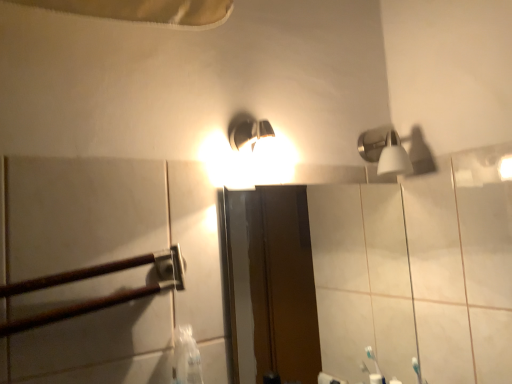
Question: From the image's perspective, would you say brown wooden rail at left is shown under matte glass mirror at center?

Choices:
 (A) yes
 (B) no

Answer: (B)

Question: Is brown wooden rail at left to the left of matte glass mirror at center from the viewer's perspective?

Choices:
 (A) no
 (B) yes

Answer: (B)

Question: Does brown wooden rail at left have a lesser width compared to matte glass mirror at center?

Choices:
 (A) no
 (B) yes

Answer: (A)

Question: Is there a large distance between brown wooden rail at left and matte glass mirror at center?

Choices:
 (A) yes
 (B) no

Answer: (B)

Question: From the image's perspective, would you say brown wooden rail at left is positioned over matte glass mirror at center?

Choices:
 (A) no
 (B) yes

Answer: (B)

Question: Does brown wooden rail at left have a larger size compared to matte glass mirror at center?

Choices:
 (A) yes
 (B) no

Answer: (B)

Question: Is matte glass mirror at center in contact with brown wooden rail at left?

Choices:
 (A) yes
 (B) no

Answer: (B)

Question: Considering the relative sizes of matte glass mirror at center and brown wooden rail at left in the image provided, is matte glass mirror at center taller than brown wooden rail at left?

Choices:
 (A) yes
 (B) no

Answer: (A)

Question: From the image's perspective, is matte glass mirror at center located beneath brown wooden rail at left?

Choices:
 (A) no
 (B) yes

Answer: (B)

Question: Does matte glass mirror at center have a greater width compared to brown wooden rail at left?

Choices:
 (A) yes
 (B) no

Answer: (B)

Question: Is matte glass mirror at center behind brown wooden rail at left?

Choices:
 (A) no
 (B) yes

Answer: (B)

Question: Is matte glass mirror at center positioned beyond the bounds of brown wooden rail at left?

Choices:
 (A) no
 (B) yes

Answer: (B)

Question: Considering the relative positions of brown wooden rail at left and satin nickel shower head at upper right in the image provided, is brown wooden rail at left behind satin nickel shower head at upper right?

Choices:
 (A) no
 (B) yes

Answer: (A)